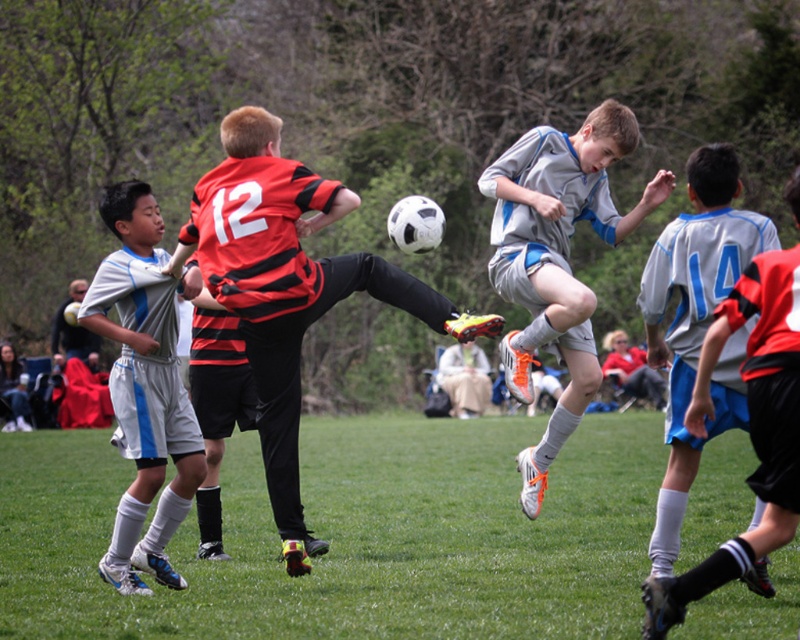
Between blue jersey at center and matte gray jacket at left, which one is positioned higher?

matte gray jacket at left is above.

Can you confirm if blue jersey at center is thinner than matte gray jacket at left?

Correct, blue jersey at center's width is less than matte gray jacket at left's.

What do you see at coordinates (632, 369) in the screenshot? I see `blue jersey at center` at bounding box center [632, 369].

This screenshot has height=640, width=800. Identify the location of blue jersey at center. (632, 369).

Does point (541, 486) come farther from viewer compared to point (90, 337)?

No, (541, 486) is closer to viewer.

Does gray/blue jersey at center appear on the right side of matte gray jacket at left?

Yes, gray/blue jersey at center is to the right of matte gray jacket at left.

Locate an element on the screen. Image resolution: width=800 pixels, height=640 pixels. gray/blue jersey at center is located at coordinates tap(558, 259).

In the scene shown: Can you confirm if red and black striped jersey at center is positioned to the right of gray/blue jersey at center?

Incorrect, red and black striped jersey at center is not on the right side of gray/blue jersey at center.

Between red and black striped jersey at center and gray/blue jersey at center, which one has less height?

gray/blue jersey at center is shorter.

Between point (249, 336) and point (530, 332), which one is positioned behind?

The point (530, 332) is behind.

This screenshot has height=640, width=800. Identify the location of red and black striped jersey at center. (288, 285).